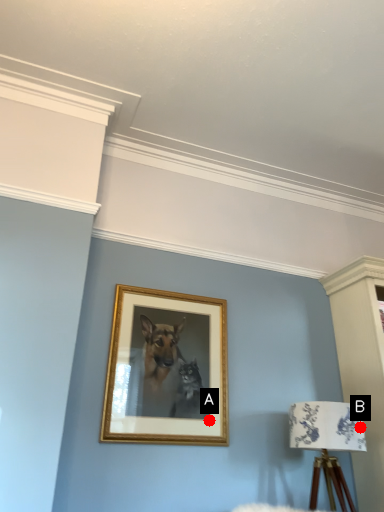
Question: Two points are circled on the image, labeled by A and B beside each circle. Which point appears closest to the camera in this image?

Choices:
 (A) A is closer
 (B) B is closer

Answer: (B)